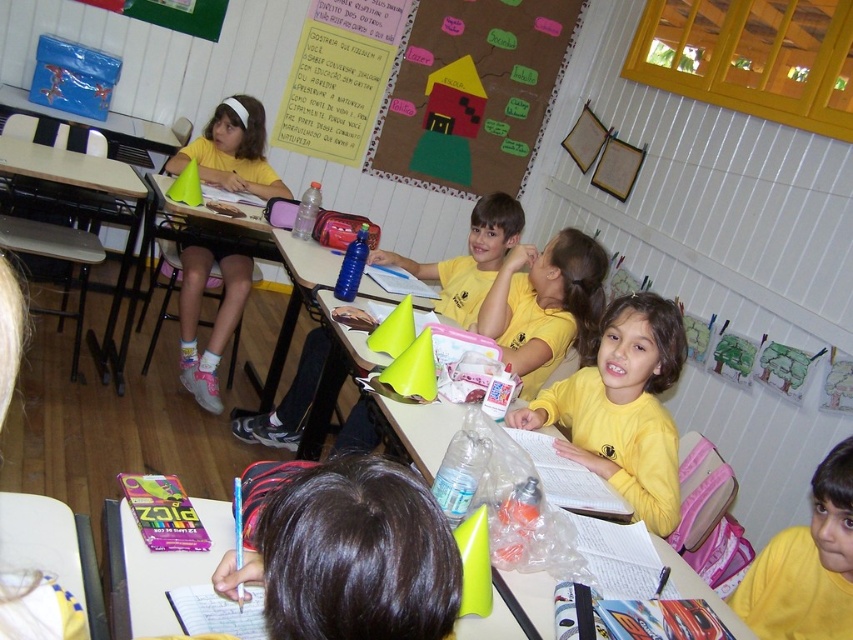
You are a teacher in the classroom and need to place a large project board on one of the tables. Which table, the white plastic table at lower center or the brown wooden table at left, can accommodate the project board based on their sizes?

The brown wooden table at left can accommodate the project board because it is larger than the white plastic table at lower center.

You are a student in the classroom and want to place your backpack on the nearest table. Which table should you choose between the white plastic table at lower center and the brown wooden table at left?

The white plastic table at lower center is closer to the viewer than the brown wooden table at left, so you should choose the white plastic table at lower center.

You are a student sitting at the desk in the classroom. You notice two points marked on your desk. The first point is at coordinates point (427,580) and the second point is at point (135,620). If you look down at your desk, which point appears closer to you?

Point (427,580) is closer to the camera than point (135,620), so the first point appears closer to you.